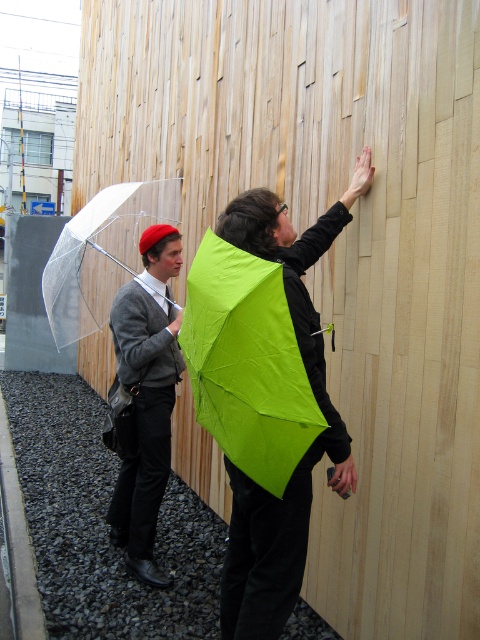
Who is more forward, (305, 410) or (106, 304)?

Point (305, 410) is in front.

Can you confirm if lime green fabric umbrella at upper center is positioned above transparent plastic umbrella at left?

Incorrect, lime green fabric umbrella at upper center is not positioned above transparent plastic umbrella at left.

What are the coordinates of `lime green fabric umbrella at upper center` in the screenshot? It's located at (247, 364).

Locate an element on the screen. Image resolution: width=480 pixels, height=640 pixels. lime green fabric umbrella at upper center is located at coordinates (247, 364).

At what (x,y) coordinates should I click in order to perform the action: click on lime green fabric umbrella at upper center. Please return your answer as a coordinate pair (x, y). The height and width of the screenshot is (640, 480). Looking at the image, I should click on (247, 364).

I want to click on lime green fabric umbrella at upper center, so click(x=247, y=364).

Between matte gray sweater at center and transparent plastic umbrella at left, which one is positioned higher?

Positioned higher is transparent plastic umbrella at left.

Between point (155, 576) and point (60, 237), which one is positioned in front?

Positioned in front is point (155, 576).

You are a GUI agent. You are given a task and a screenshot of the screen. Output one action in this format:
    pyautogui.click(x=<x>, y=<y>)
    Task: Click on the matte gray sweater at center
    The image size is (480, 640).
    Given the screenshot: What is the action you would take?
    pyautogui.click(x=144, y=400)